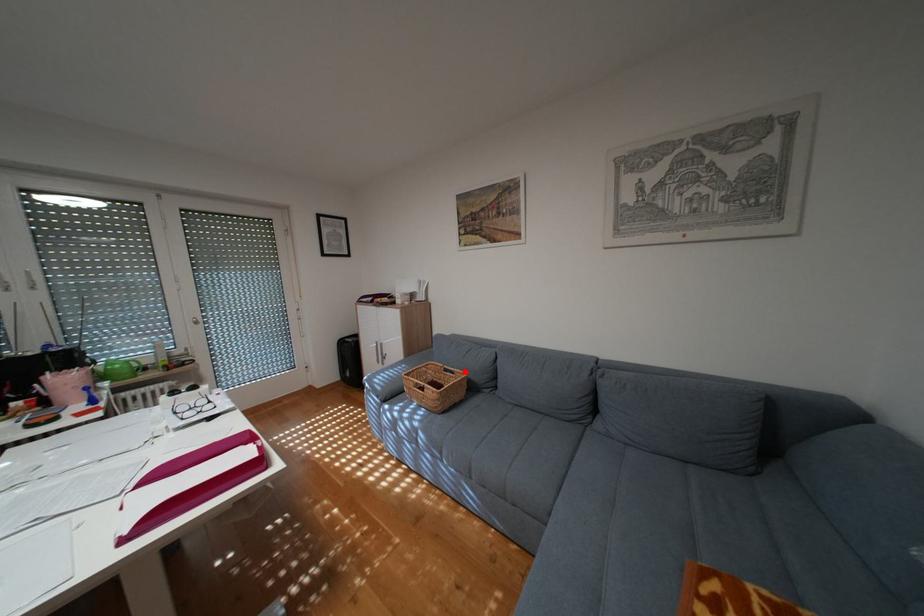
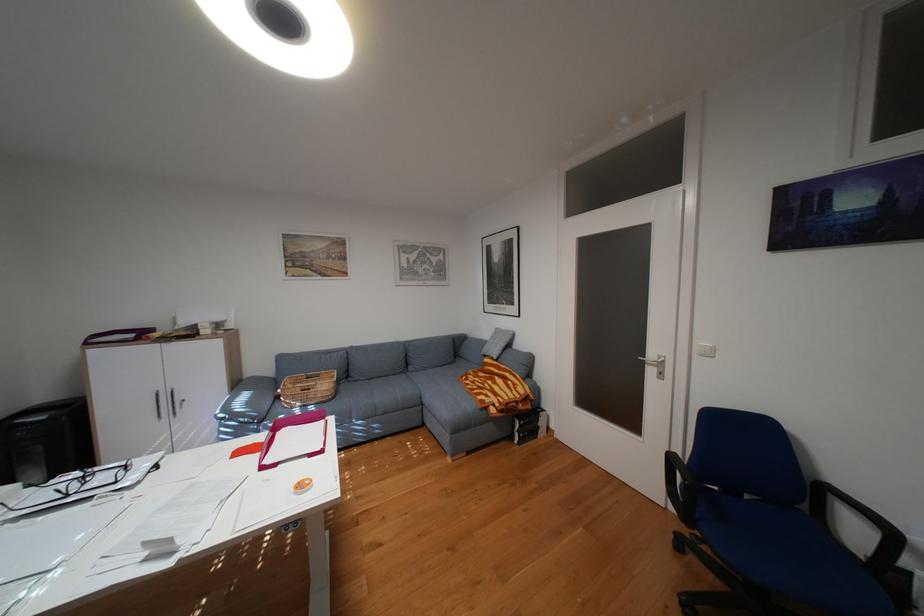
Question: I am providing you with two images of the same scene from different viewpoints. Given a red point in image1, look at the same physical point in image2. Is it:

Choices:
 (A) Closer to the viewpoint
 (B) Farther from the viewpoint

Answer: (A)